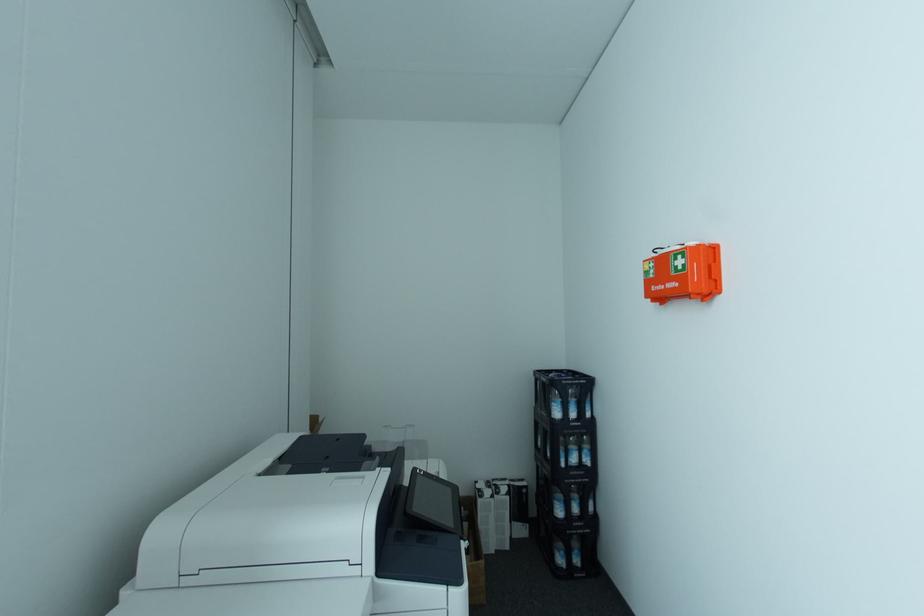
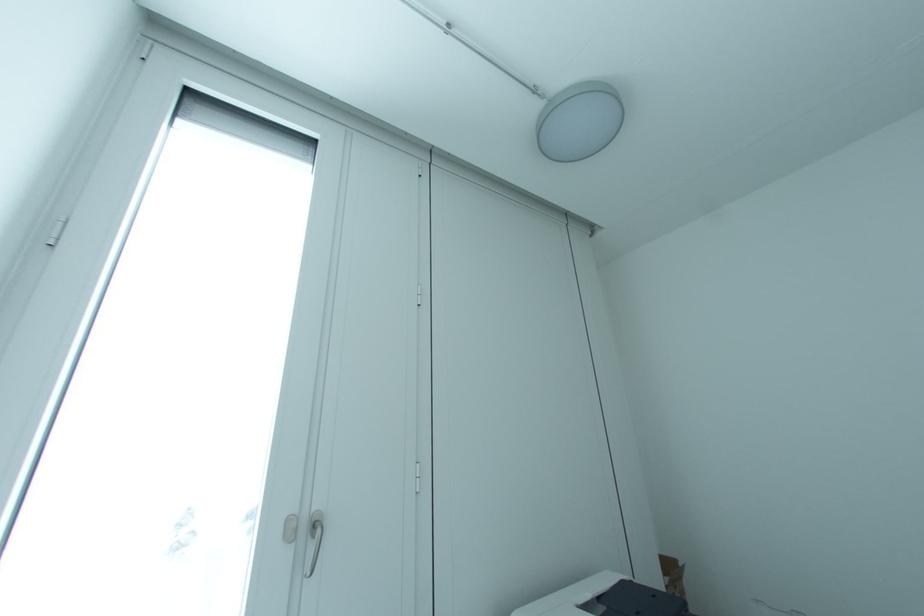
Based on the continuous images, in which direction is the camera rotating?

The rotation direction of the camera is left-up.